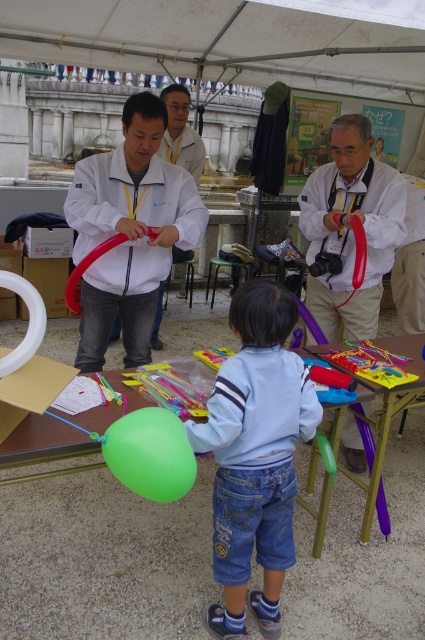
You are a photographer at the event and want to capture a photo of the matte white jacket at center without the green rubber balloon at lower center appearing in the frame. Is it possible to do so by adjusting your camera angle?

The green rubber balloon at lower center is behind the matte white jacket at center, so yes, you can position the camera so that the matte white jacket at center blocks the view of the balloon, making it possible to take a photo without the balloon in the frame.

You are standing at the point labeled point (326,209) and want to walk to point (161,490). Which direction should you move relative to your current position?

You should move downward and to the right because point (161,490) is located below and to the right of point (326,209).

You are standing at the camera position and want to reach the matte white balloon at center. The path is clear except for a small dog that is 1.5 meters away from you. Can you safely walk to the balloon without stepping on the dog?

The matte white balloon at center is 3.05 meters away from you. Since the dog is only 1.5 meters away, you can walk around the dog to reach the balloon safely as long as you maintain a path that avoids the dog.